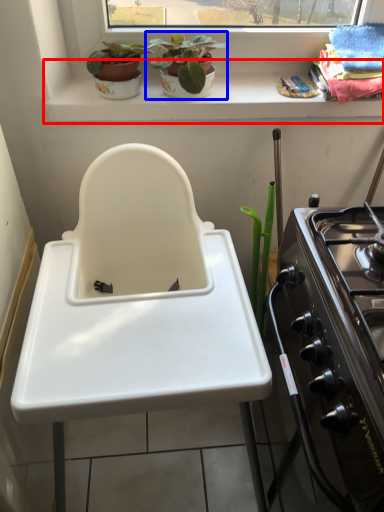
Question: Which point is closer to the camera, window sill (highlighted by a red box) or houseplant (highlighted by a blue box)?

Choices:
 (A) window sill
 (B) houseplant

Answer: (B)